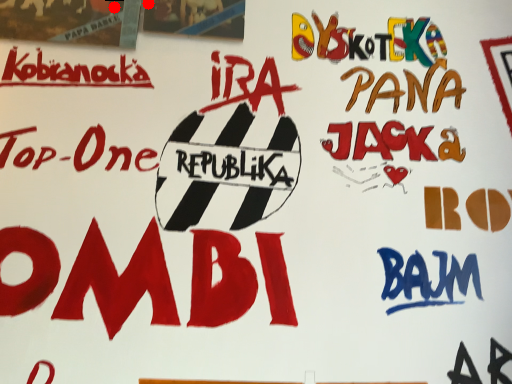
Question: Two points are circled on the image, labeled by A and B beside each circle. Which point appears closest to the camera in this image?

Choices:
 (A) A is closer
 (B) B is closer

Answer: (B)